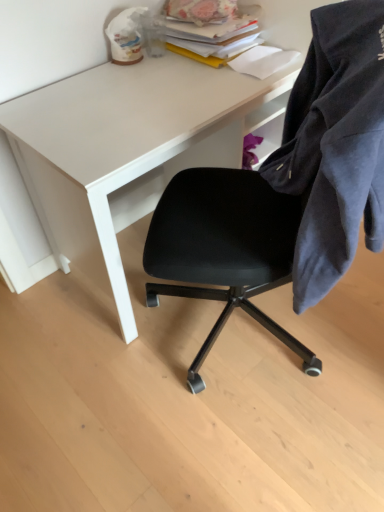
Question: Considering the relative positions of white matte desk at upper center and dark blue cotton jacket at right in the image provided, is white matte desk at upper center to the right of dark blue cotton jacket at right from the viewer's perspective?

Choices:
 (A) yes
 (B) no

Answer: (B)

Question: Does white matte desk at upper center have a smaller size compared to dark blue cotton jacket at right?

Choices:
 (A) no
 (B) yes

Answer: (A)

Question: Is white matte desk at upper center taller than dark blue cotton jacket at right?

Choices:
 (A) no
 (B) yes

Answer: (B)

Question: Is white matte desk at upper center closer to camera compared to dark blue cotton jacket at right?

Choices:
 (A) no
 (B) yes

Answer: (A)

Question: Is white matte desk at upper center looking in the opposite direction of dark blue cotton jacket at right?

Choices:
 (A) no
 (B) yes

Answer: (A)

Question: Is stacked paper at upper right situated inside dark blue cotton jacket at right or outside?

Choices:
 (A) inside
 (B) outside

Answer: (B)

Question: Considering their positions, is stacked paper at upper right located in front of or behind dark blue cotton jacket at right?

Choices:
 (A) behind
 (B) front

Answer: (A)

Question: From the image's perspective, is stacked paper at upper right positioned above or below dark blue cotton jacket at right?

Choices:
 (A) below
 (B) above

Answer: (B)

Question: Is stacked paper at upper right bigger or smaller than dark blue cotton jacket at right?

Choices:
 (A) small
 (B) big

Answer: (A)

Question: Does point (365, 185) appear closer or farther from the camera than point (276, 10)?

Choices:
 (A) farther
 (B) closer

Answer: (B)

Question: From a real-world perspective, is dark blue cotton jacket at right above or below white matte desk at upper center?

Choices:
 (A) below
 (B) above

Answer: (B)

Question: From the image's perspective, is dark blue cotton jacket at right located above or below white matte desk at upper center?

Choices:
 (A) below
 (B) above

Answer: (A)

Question: Is dark blue cotton jacket at right inside or outside of white matte desk at upper center?

Choices:
 (A) inside
 (B) outside

Answer: (B)

Question: Considering the positions of dark blue cotton jacket at right and stacked paper at upper right in the image, is dark blue cotton jacket at right taller or shorter than stacked paper at upper right?

Choices:
 (A) short
 (B) tall

Answer: (B)

Question: Relative to stacked paper at upper right, is dark blue cotton jacket at right in front or behind?

Choices:
 (A) front
 (B) behind

Answer: (A)